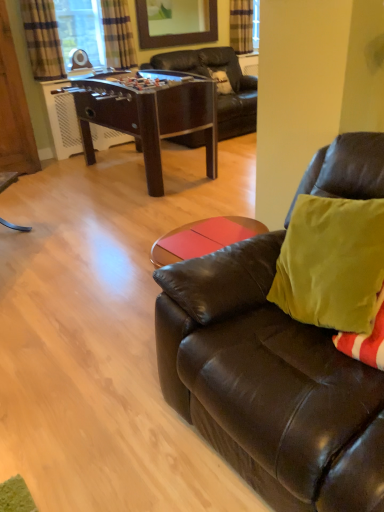
Image resolution: width=384 pixels, height=512 pixels. What are the coordinates of `wooden armoire at left` in the screenshot? It's located at (14, 109).

Locate an element on the screen. The width and height of the screenshot is (384, 512). brown wooden foosball table at center is located at coordinates (149, 118).

This screenshot has width=384, height=512. What do you see at coordinates (176, 22) in the screenshot?
I see `wooden frame mirror at upper center` at bounding box center [176, 22].

You are a GUI agent. You are given a task and a screenshot of the screen. Output one action in this format:
    pyautogui.click(x=<x>, y=<y>)
    Task: Click on the plaid fabric curtain at upper left, the 2th curtain viewed from the right
    This screenshot has height=512, width=384.
    Given the screenshot: What is the action you would take?
    pyautogui.click(x=118, y=34)

Image resolution: width=384 pixels, height=512 pixels. Describe the element at coordinates (42, 39) in the screenshot. I see `plaid fabric curtain at upper left, positioned as the 3th curtain in right-to-left order` at that location.

Locate an element on the screen. wooden armoire at left is located at coordinates (14, 109).

Considering the sizes of brown wooden foosball table at center and wooden armoire at left in the image, is brown wooden foosball table at center taller or shorter than wooden armoire at left?

Considering their sizes, brown wooden foosball table at center has less height than wooden armoire at left.

Consider the image. Would you say brown wooden foosball table at center is a long distance from wooden armoire at left?

Indeed, brown wooden foosball table at center is not near wooden armoire at left.

Is brown wooden foosball table at center outside of wooden armoire at left?

Absolutely, brown wooden foosball table at center is external to wooden armoire at left.

Measure the distance between brown wooden foosball table at center and wooden armoire at left.

A distance of 3.41 feet exists between brown wooden foosball table at center and wooden armoire at left.

From a real-world perspective, relative to wooden frame mirror at upper center, is plaid fabric curtain at upper left, the 2th curtain when ordered from back to front, vertically above or below?

In terms of real-world spatial position, plaid fabric curtain at upper left, the 2th curtain when ordered from back to front, is below wooden frame mirror at upper center.

Based on the photo, considering the sizes of objects plaid fabric curtain at upper left, the 2th curtain viewed from the right, and wooden frame mirror at upper center in the image provided, who is thinner, plaid fabric curtain at upper left, the 2th curtain viewed from the right, or wooden frame mirror at upper center?

Thinner between the two is wooden frame mirror at upper center.

Is point (120, 39) more distant than point (147, 17)?

No, (120, 39) is in front of (147, 17).

From the picture: Is plaid fabric curtain at upper left, the 2th curtain viewed from the right, completely or partially outside of wooden frame mirror at upper center?

That's correct, plaid fabric curtain at upper left, the 2th curtain viewed from the right, is outside of wooden frame mirror at upper center.

Which object is thinner, wooden frame mirror at upper center or plaid fabric curtain at upper center, which is counted as the third curtain, starting from the left?

Thinner between the two is wooden frame mirror at upper center.

Looking at this image, is wooden frame mirror at upper center not within plaid fabric curtain at upper center, the first curtain viewed from the back?

Yes, wooden frame mirror at upper center is located beyond the bounds of plaid fabric curtain at upper center, the first curtain viewed from the back.

Considering the sizes of objects wooden frame mirror at upper center and plaid fabric curtain at upper center, which is counted as the third curtain, starting from the left, in the image provided, who is taller, wooden frame mirror at upper center or plaid fabric curtain at upper center, which is counted as the third curtain, starting from the left,?

plaid fabric curtain at upper center, which is counted as the third curtain, starting from the left.

Consider the image. Is wooden frame mirror at upper center aimed at plaid fabric curtain at upper center, which is the third curtain from front to back?

No, wooden frame mirror at upper center is not facing towards plaid fabric curtain at upper center, which is the third curtain from front to back.

How different are the orientations of wooden armoire at left and plaid fabric curtain at upper center, which is counted as the third curtain, starting from the left, in degrees?

The angular difference between wooden armoire at left and plaid fabric curtain at upper center, which is counted as the third curtain, starting from the left, is 1.74 degrees.

Looking at this image, considering the sizes of objects wooden armoire at left and plaid fabric curtain at upper center, which is the third curtain from front to back, in the image provided, who is shorter, wooden armoire at left or plaid fabric curtain at upper center, which is the third curtain from front to back,?

plaid fabric curtain at upper center, which is the third curtain from front to back, is shorter.

Measure the distance between wooden armoire at left and plaid fabric curtain at upper center, the 1th curtain when ordered from right to left.

The distance of wooden armoire at left from plaid fabric curtain at upper center, the 1th curtain when ordered from right to left, is 3.48 meters.

From the image's perspective, does wooden armoire at left appear lower than plaid fabric curtain at upper center, which is counted as the third curtain, starting from the left?

Yes.

Is wooden frame mirror at upper center situated inside wooden armoire at left or outside?

wooden frame mirror at upper center exists outside the volume of wooden armoire at left.

Does wooden frame mirror at upper center have a greater width compared to wooden armoire at left?

No.

From a real-world perspective, between wooden frame mirror at upper center and wooden armoire at left, who is vertically higher?

wooden frame mirror at upper center is physically above.

Choose the correct answer: Is plaid fabric curtain at upper left, positioned as the 3th curtain in right-to-left order, inside matte brown leather couch at right or outside it?

plaid fabric curtain at upper left, positioned as the 3th curtain in right-to-left order, cannot be found inside matte brown leather couch at right.

Between plaid fabric curtain at upper left, positioned as the 3th curtain in right-to-left order, and matte brown leather couch at right, which one is positioned in front?

matte brown leather couch at right.

Considering the relative sizes of plaid fabric curtain at upper left, the 3th curtain when ordered from back to front, and matte brown leather couch at right in the image provided, is plaid fabric curtain at upper left, the 3th curtain when ordered from back to front, taller than matte brown leather couch at right?

In fact, plaid fabric curtain at upper left, the 3th curtain when ordered from back to front, may be shorter than matte brown leather couch at right.

From the image's perspective, count 1st curtains upward from the matte brown leather couch at right and point to it. Please provide its 2D coordinates.

[(42, 39)]

You are a GUI agent. You are given a task and a screenshot of the screen. Output one action in this format:
    pyautogui.click(x=<x>, y=<y>)
    Task: Click on the 2nd curtain behind the plaid fabric curtain at upper left, positioned as the 1th curtain in left-to-right order, starting your count from the anchor
    The height and width of the screenshot is (512, 384).
    Given the screenshot: What is the action you would take?
    pyautogui.click(x=241, y=26)

From the image's perspective, does plaid fabric curtain at upper left, placed as the first curtain when sorted from front to back, appear lower than plaid fabric curtain at upper center, which is the third curtain from front to back?

Yes, from the image's perspective, plaid fabric curtain at upper left, placed as the first curtain when sorted from front to back, is beneath plaid fabric curtain at upper center, which is the third curtain from front to back.

From a real-world perspective, is plaid fabric curtain at upper left, the 3th curtain when ordered from back to front, above or below plaid fabric curtain at upper center, which is the third curtain from front to back?

plaid fabric curtain at upper left, the 3th curtain when ordered from back to front, is above plaid fabric curtain at upper center, which is the third curtain from front to back.

Considering the sizes of objects plaid fabric curtain at upper left, the 3th curtain when ordered from back to front, and plaid fabric curtain at upper center, which is the third curtain from front to back, in the image provided, who is smaller, plaid fabric curtain at upper left, the 3th curtain when ordered from back to front, or plaid fabric curtain at upper center, which is the third curtain from front to back,?

Smaller between the two is plaid fabric curtain at upper center, which is the third curtain from front to back.

Image resolution: width=384 pixels, height=512 pixels. In order to click on armoire above the brown wooden foosball table at center (from the image's perspective) in this screenshot , I will do `click(14, 109)`.

Identify the location of the 1st curtain to the left when counting from the wooden frame mirror at upper center. (118, 34).

From the image, which object appears to be nearer to wooden frame mirror at upper center, matte brown leather couch at right or plaid fabric curtain at upper left, the 3th curtain when ordered from back to front?

plaid fabric curtain at upper left, the 3th curtain when ordered from back to front, is closer to wooden frame mirror at upper center.

Which object lies nearer to the anchor point wooden armoire at left, matte brown leather couch at right or plaid fabric curtain at upper center, the 1th curtain when ordered from right to left?

plaid fabric curtain at upper center, the 1th curtain when ordered from right to left, lies closer to wooden armoire at left than the other object.

When comparing their distances from brown wooden foosball table at center, does plaid fabric curtain at upper left, the second curtain from the front, or plaid fabric curtain at upper center, the first curtain viewed from the back, seem further?

plaid fabric curtain at upper center, the first curtain viewed from the back.

Looking at the image, which one is located further to brown wooden foosball table at center, plaid fabric curtain at upper left, the 2th curtain viewed from the right, or matte brown leather couch at right?

The object further to brown wooden foosball table at center is matte brown leather couch at right.

Estimate the real-world distances between objects in this image. Which object is further from wooden armoire at left, plaid fabric curtain at upper left, positioned as the 3th curtain in right-to-left order, or plaid fabric curtain at upper left, the second curtain from the front?

plaid fabric curtain at upper left, the second curtain from the front, is further to wooden armoire at left.

Consider the image. Estimate the real-world distances between objects in this image. Which object is closer to plaid fabric curtain at upper left, positioned as the 1th curtain in left-to-right order, plaid fabric curtain at upper left, which is the 2th curtain in left-to-right order, or plaid fabric curtain at upper center, the 1th curtain when ordered from right to left?

plaid fabric curtain at upper left, which is the 2th curtain in left-to-right order, lies closer to plaid fabric curtain at upper left, positioned as the 1th curtain in left-to-right order, than the other object.

Consider the image. Looking at the image, which one is located closer to wooden armoire at left, plaid fabric curtain at upper left, which is the 2th curtain in left-to-right order, or brown wooden foosball table at center?

The object closer to wooden armoire at left is brown wooden foosball table at center.

Considering their positions, is plaid fabric curtain at upper center, which is counted as the third curtain, starting from the left, positioned further to plaid fabric curtain at upper left, which is the 2th curtain in left-to-right order, than wooden frame mirror at upper center?

plaid fabric curtain at upper center, which is counted as the third curtain, starting from the left, is positioned further to the anchor plaid fabric curtain at upper left, which is the 2th curtain in left-to-right order.

Where is `armoire between matte brown leather couch at right and plaid fabric curtain at upper left, positioned as the 3th curtain in right-to-left order, along the z-axis`? Image resolution: width=384 pixels, height=512 pixels. armoire between matte brown leather couch at right and plaid fabric curtain at upper left, positioned as the 3th curtain in right-to-left order, along the z-axis is located at coordinates pos(14,109).

The image size is (384, 512). Identify the location of armoire positioned between matte brown leather couch at right and plaid fabric curtain at upper center, the first curtain viewed from the back, from near to far. (14, 109).

The height and width of the screenshot is (512, 384). Identify the location of mirror between brown wooden foosball table at center and plaid fabric curtain at upper center, which is the third curtain from front to back, in the front-back direction. (176, 22).

Locate an element on the screen. desk located between wooden armoire at left and wooden frame mirror at upper center in the left-right direction is located at coordinates (149, 118).